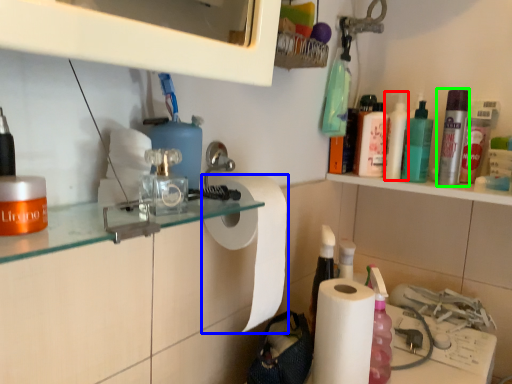
Question: Which object is positioned farthest from cleaning product (highlighted by a red box)? Select from paper towel (highlighted by a blue box) and mouthwash (highlighted by a green box).

Choices:
 (A) paper towel
 (B) mouthwash

Answer: (A)